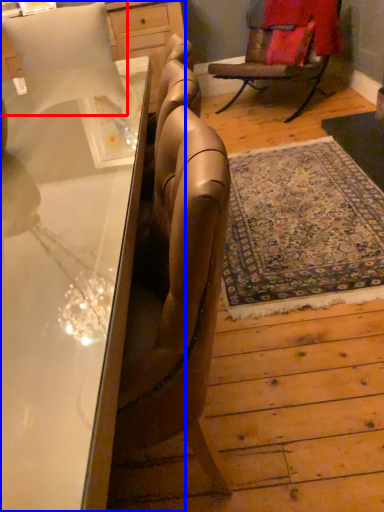
Question: Which of the following is the farthest to the observer, pillow (highlighted by a red box) or desk (highlighted by a blue box)?

Choices:
 (A) pillow
 (B) desk

Answer: (A)